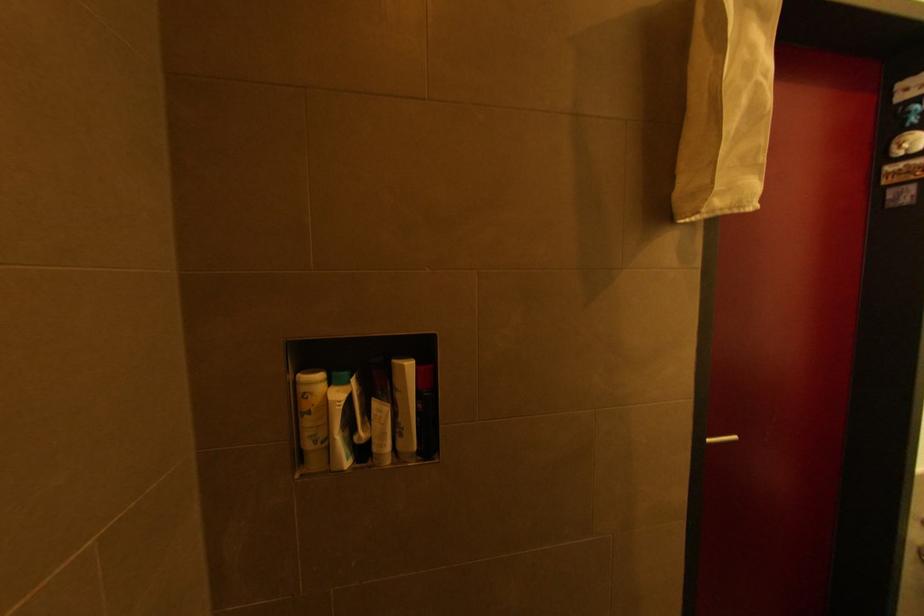
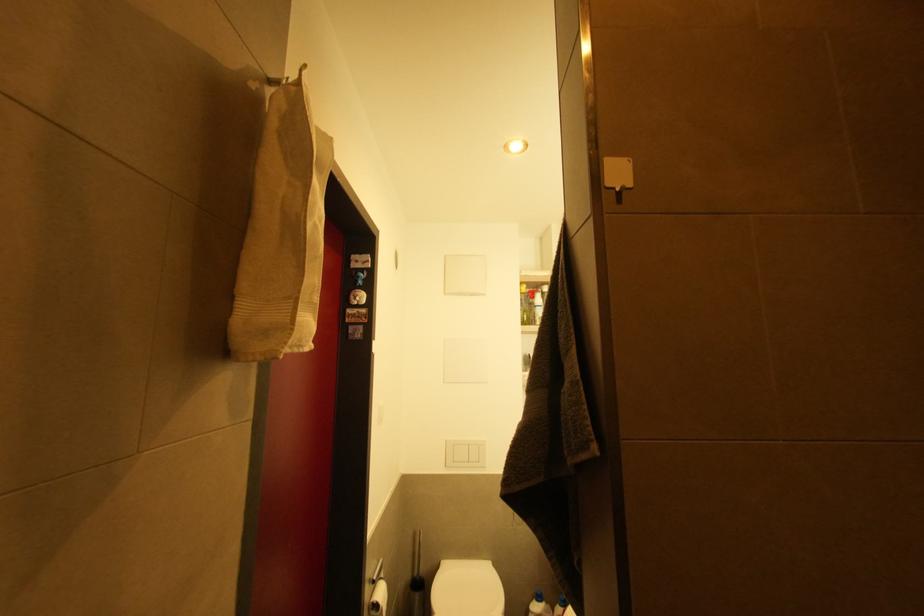
Question: The images are taken continuously from a first-person perspective. In which direction is your viewpoint rotating?

Choices:
 (A) Left
 (B) Right
 (C) Up
 (D) Down

Answer: (B)